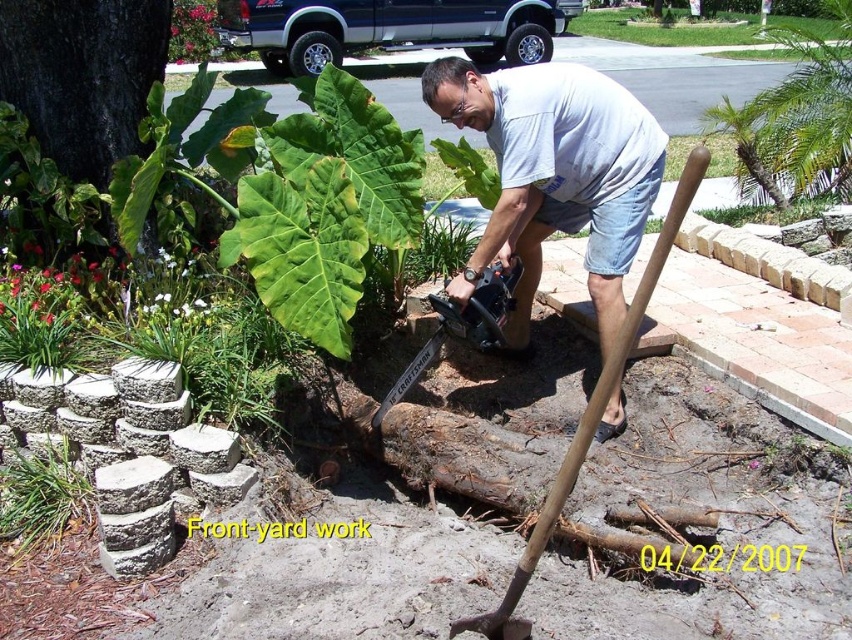
Is gray matte shirt at center taller than green grass at lower left?

Yes.

Is point (542, 212) farther from viewer compared to point (65, 472)?

Yes, it is behind point (65, 472).

This screenshot has width=852, height=640. In order to click on gray matte shirt at center in this screenshot , I will do `click(556, 173)`.

Which is behind, point (36, 1) or point (579, 449)?

The point (36, 1) is more distant.

Identify the location of dark green leafy tree at upper left. The width and height of the screenshot is (852, 640). (x=83, y=76).

Between dark green leafy tree at upper left and green leafy plant at upper center, which one appears on the left side from the viewer's perspective?

dark green leafy tree at upper left is more to the left.

Does dark green leafy tree at upper left have a lesser height compared to green leafy plant at upper center?

No.

Is point (101, 61) positioned before point (830, 19)?

That is True.

You are a GUI agent. You are given a task and a screenshot of the screen. Output one action in this format:
    pyautogui.click(x=<x>, y=<y>)
    Task: Click on the dark green leafy tree at upper left
    
    Given the screenshot: What is the action you would take?
    pyautogui.click(x=83, y=76)